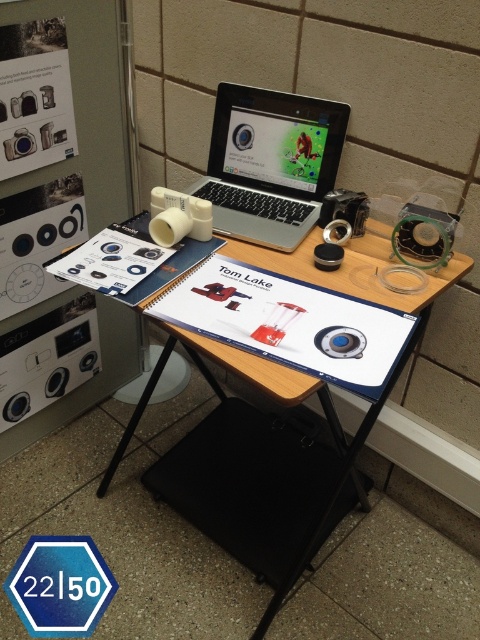
You are setting up a photography display and need to place a large photography manual next to the wooden table at center and the silver metallic laptop at center. Given that the manual is 1.2 meters wide, will there be enough space on the table to accommodate it alongside both objects?

The wooden table at center is larger in size than the silver metallic laptop at center, but the exact dimensions of the table aren t provided. However, since the manual is 1.2 meters wide and the table is larger than the laptop, it might have sufficient space. However, without knowing the table s full dimensions, it s uncertain if it can fit the manual alongside both objects.

You are a photographer setting up your equipment. You need to place a new camera lens on the wooden table at center. However, you notice the silver metallic laptop at center is in the way. Can you move the laptop to the side to make space without moving the table?

The wooden table at center is closer to the viewer than the silver metallic laptop at center, so you can move the laptop to the side to make space since it is behind the table.